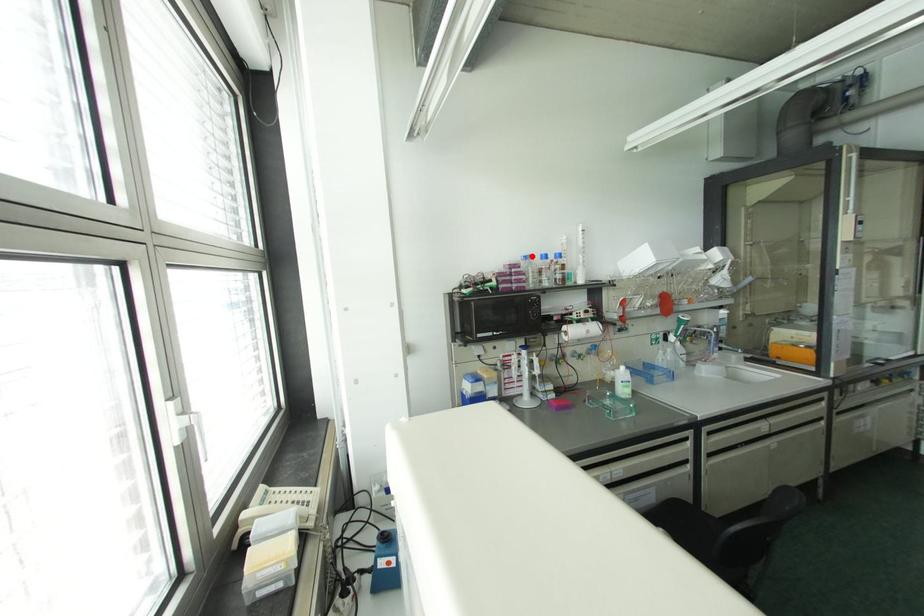
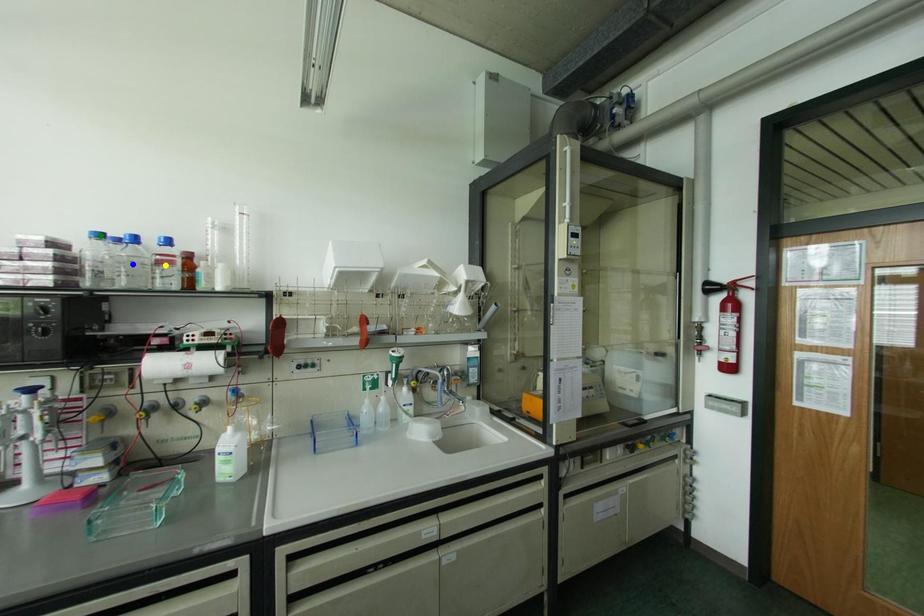
Question: I am providing you with two images of the same scene from different viewpoints. A red point is marked on the first image. You are given multiple points on the second image. Which spot in image 2 lines up with the point in image 1?

Choices:
 (A) green point
 (B) blue point
 (C) yellow point

Answer: (A)